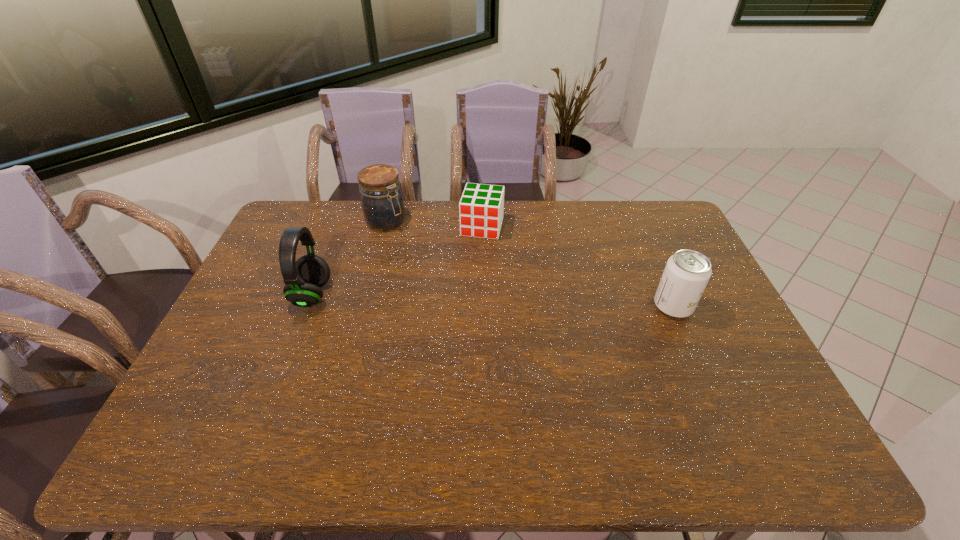
The image size is (960, 540). Identify the location of free space between the shortest object and the second shortest object. (578, 266).

At what (x,y) coordinates should I click in order to perform the action: click on empty location between the jar and the second shortest object. Please return your answer as a coordinate pair (x, y). The height and width of the screenshot is (540, 960). Looking at the image, I should click on 530,264.

Identify the location of vacant space in between the jar and the cube. This screenshot has width=960, height=540. coord(434,224).

The height and width of the screenshot is (540, 960). I want to click on unoccupied area between the third object from right to left and the leftmost object, so click(x=349, y=258).

Choose which object is the nearest neighbor to the leftmost object. Please provide its 2D coordinates. Your answer should be formatted as a tuple, i.e. [(x, y)], where the tuple contains the x and y coordinates of a point satisfying the conditions above.

[(382, 202)]

Where is `the closest object relative to the soda can`? The width and height of the screenshot is (960, 540). the closest object relative to the soda can is located at coordinates (481, 207).

Locate an element on the screen. vacant space that satisfies the following two spatial constraints: 1. on the front side of the soda can; 2. on the right side of the third object from right to left is located at coordinates (364, 306).